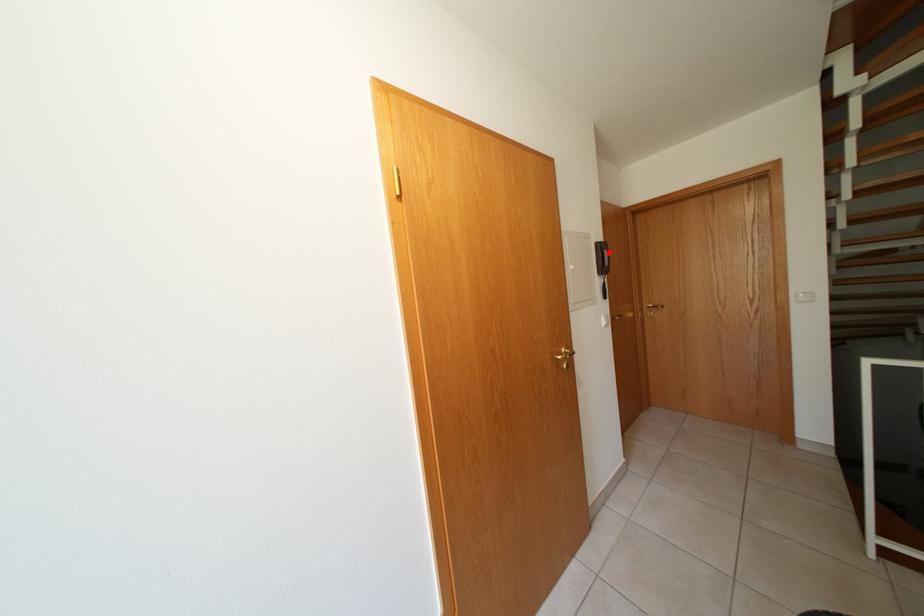
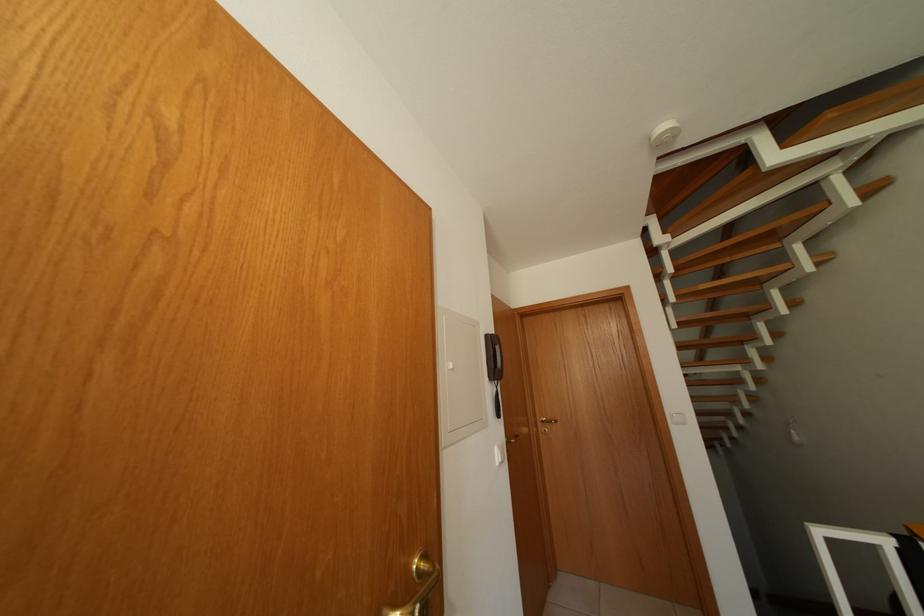
Find the pixel in the second image that matches the highlighted location in the first image.

(500, 346)